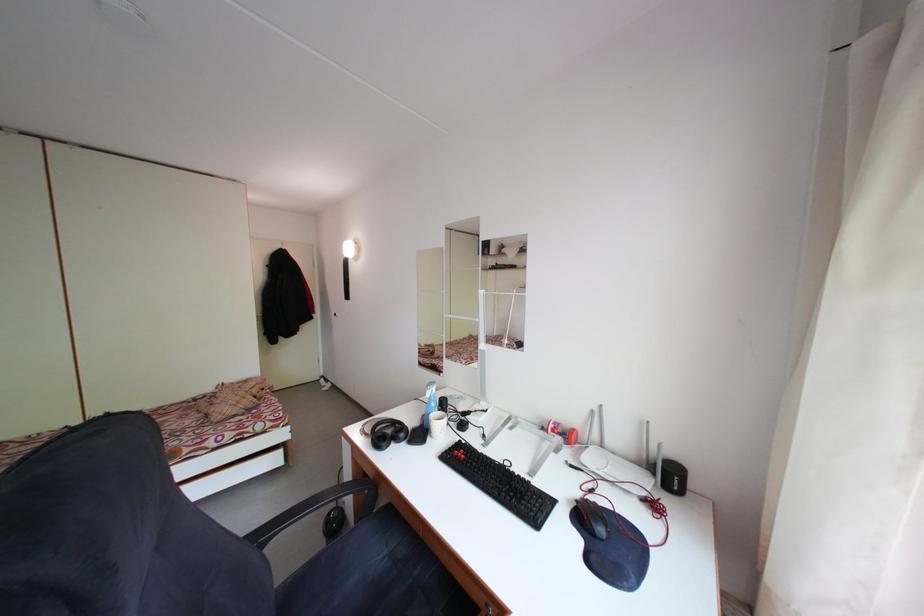
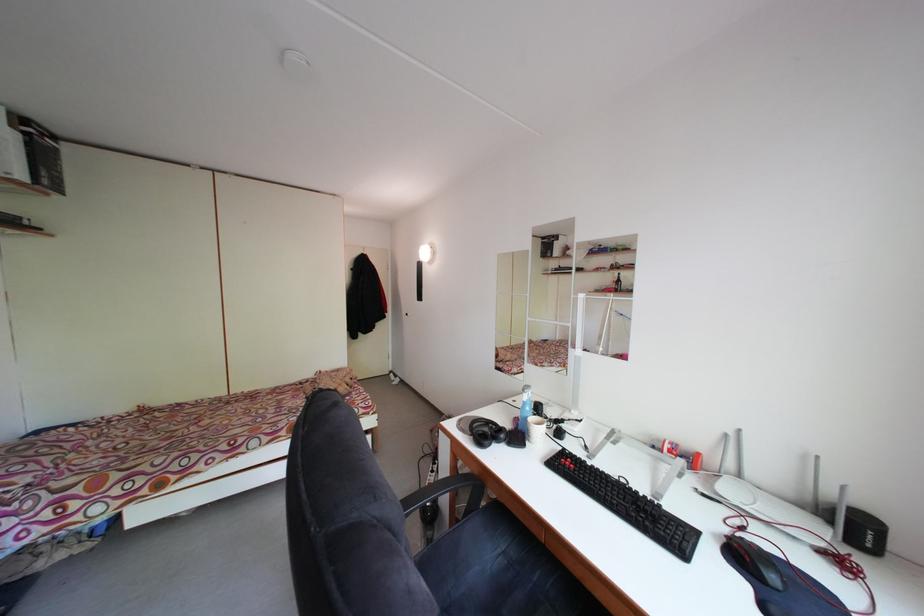
Question: The images are taken continuously from a first-person perspective. In which direction is your viewpoint rotating?

Choices:
 (A) Left
 (B) Right
 (C) Up
 (D) Down

Answer: (A)